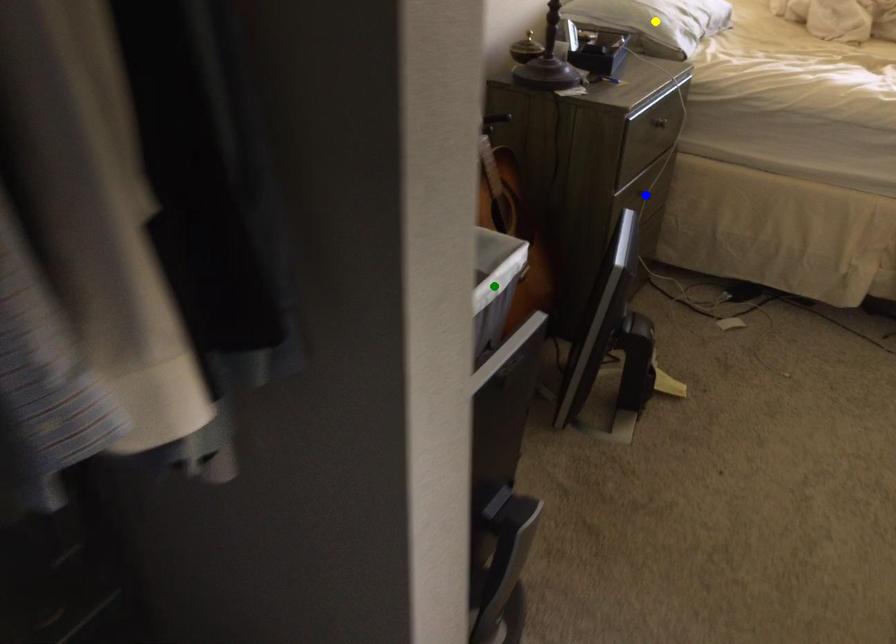
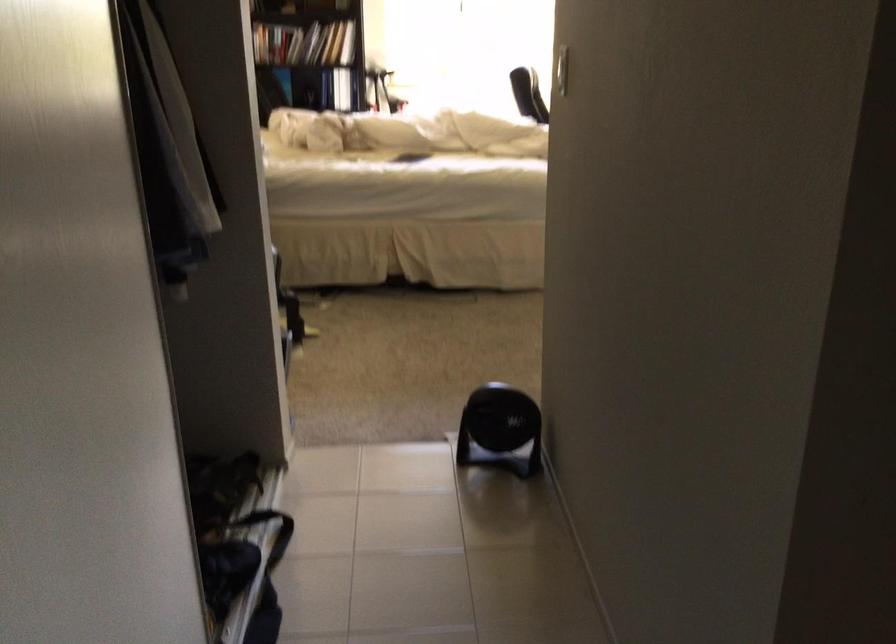
I am providing you with two images of the same scene from different viewpoints. Three points are marked in image1. Which point corresponds to a part or object that is occluded in image2?In image1, three points are marked. Which of them correspond to a part or object that is occluded in image2?Among the three points shown in image1, which one corresponds to a part or object that is no longer visible due to occlusion in image2?

yellow point, blue point, green point